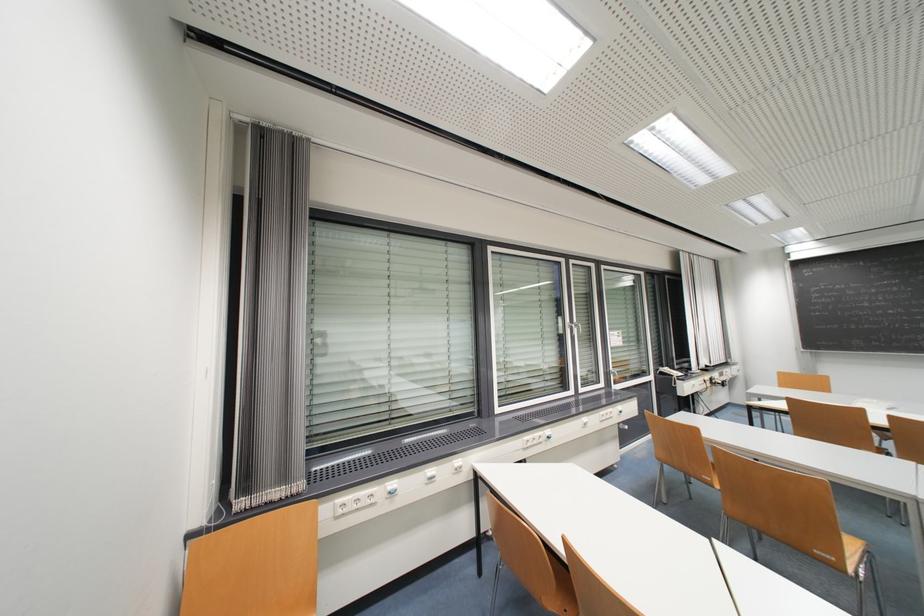
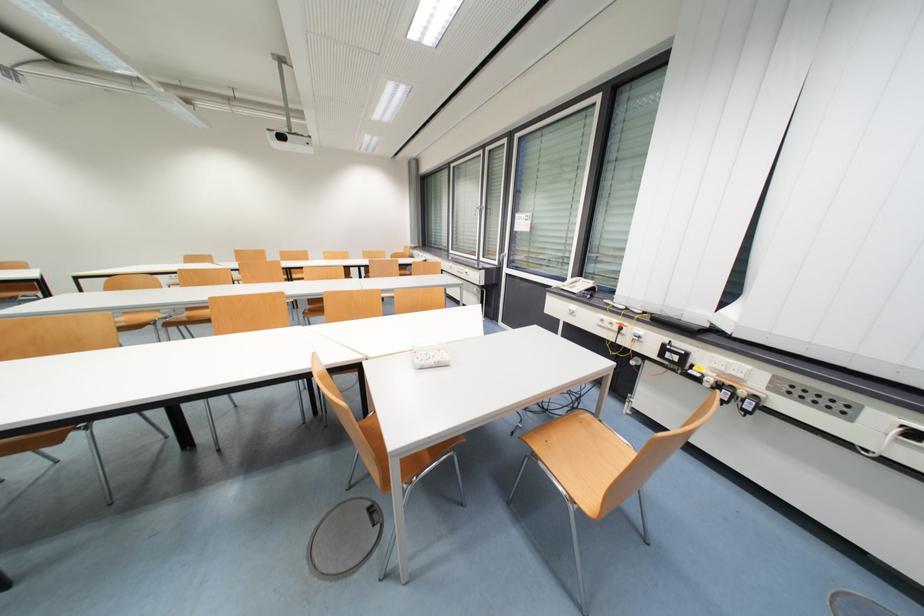
Locate, in the second image, the point that corresponds to point 716,381 in the first image.

(671, 350)